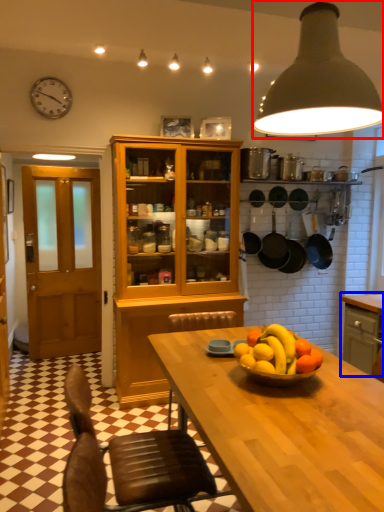
Question: Which object is further to the camera taking this photo, light (highlighted by a red box) or cabinetry (highlighted by a blue box)?

Choices:
 (A) light
 (B) cabinetry

Answer: (B)